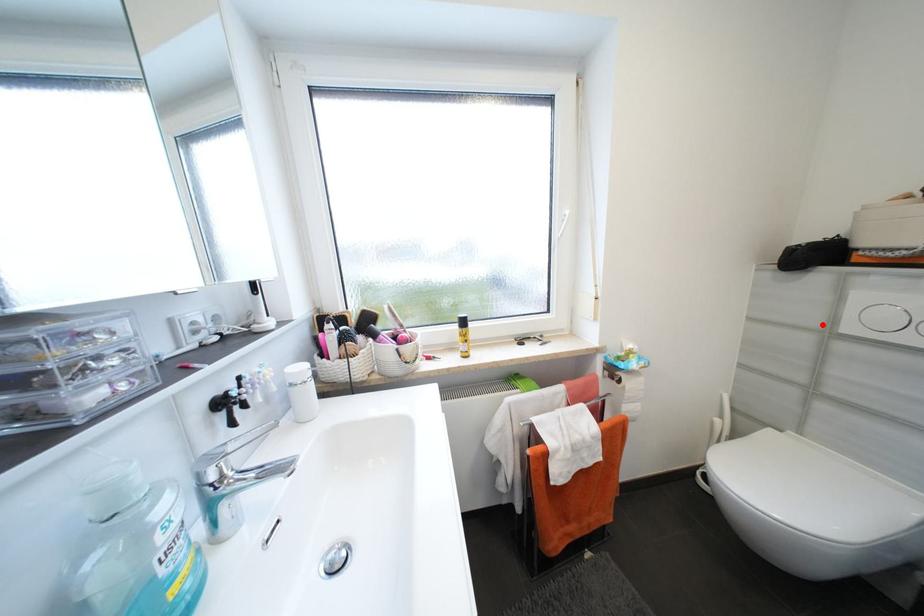
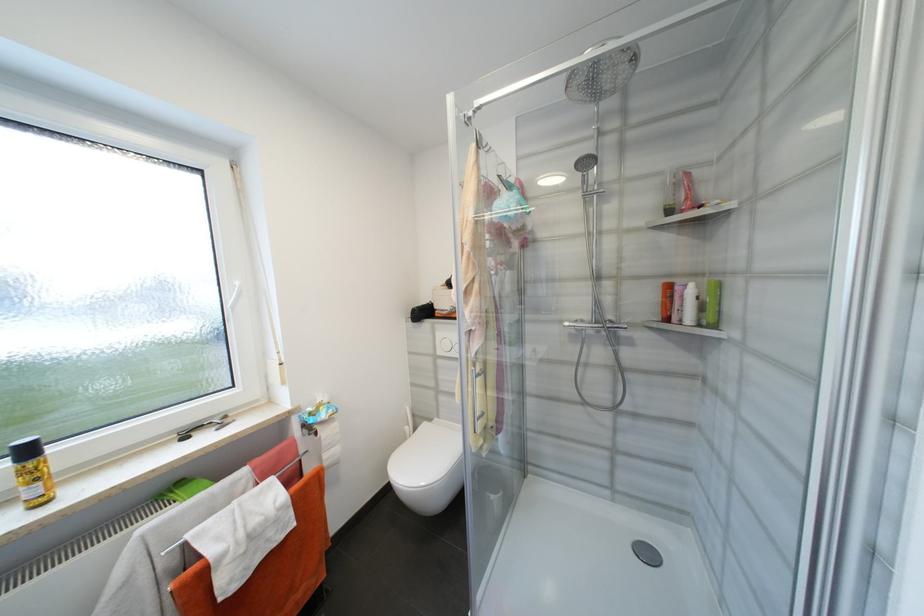
Locate, in the second image, the point that corresponds to the highlighted location in the first image.

(436, 352)